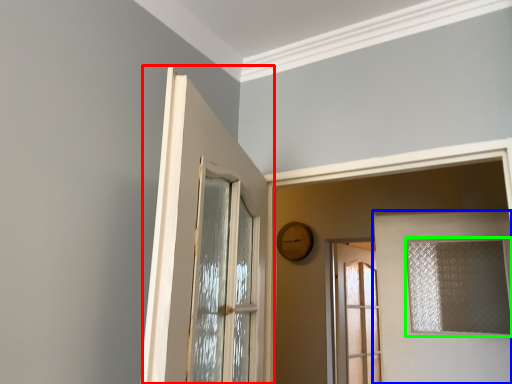
Question: Based on their relative distances, which object is nearer to door (highlighted by a red box)? Choose from door (highlighted by a blue box) and window (highlighted by a green box).

Choices:
 (A) door
 (B) window

Answer: (A)